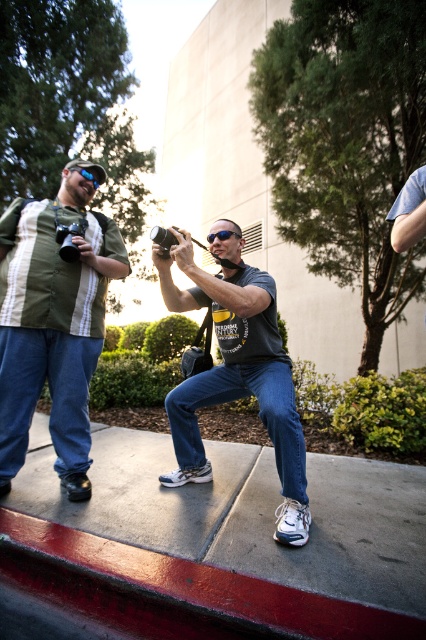
You are a photographer trying to capture a candid shot of two people in an urban park. You have a matte black camera at center and black plastic goggles at center. Based on their positions, which object is higher up in the frame?

The matte black camera at center is positioned above the black plastic goggles at center in the frame.